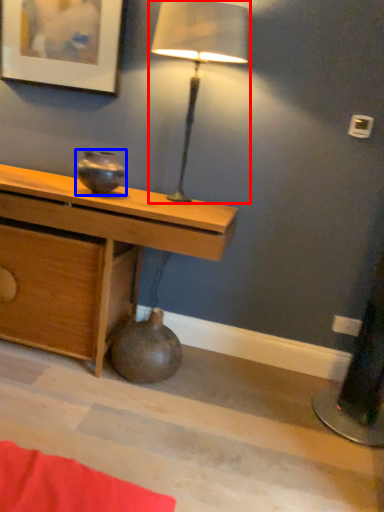
Question: Among these objects, which one is nearest to the camera, lamp (highlighted by a red box) or vase (highlighted by a blue box)?

Choices:
 (A) lamp
 (B) vase

Answer: (A)